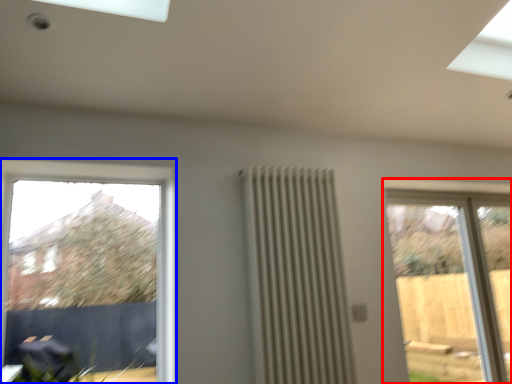
Question: Among these objects, which one is farthest to the camera, window (highlighted by a red box) or window (highlighted by a blue box)?

Choices:
 (A) window
 (B) window

Answer: (A)